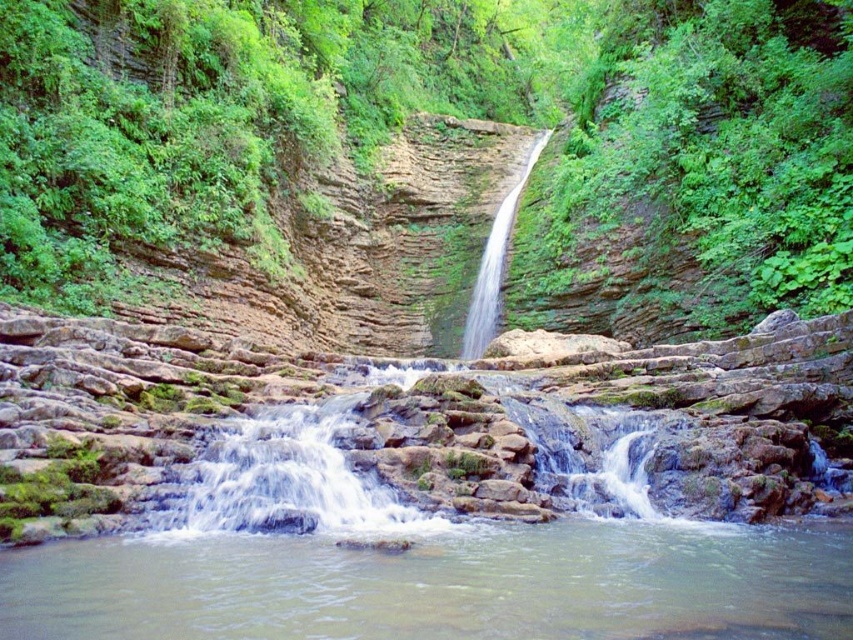
Is clear water stream at center wider than white frothy water at center?

Indeed, clear water stream at center has a greater width compared to white frothy water at center.

Locate an element on the screen. Image resolution: width=853 pixels, height=640 pixels. clear water stream at center is located at coordinates (440, 584).

This screenshot has width=853, height=640. What are the coordinates of `clear water stream at center` in the screenshot? It's located at (440, 584).

The width and height of the screenshot is (853, 640). I want to click on clear water stream at center, so click(x=440, y=584).

Is green leafy vegetation at center smaller than clear water stream at center?

Incorrect, green leafy vegetation at center is not smaller in size than clear water stream at center.

From the picture: Can you confirm if green leafy vegetation at center is thinner than clear water stream at center?

Incorrect, green leafy vegetation at center's width is not less than clear water stream at center's.

Describe the element at coordinates (437, 112) in the screenshot. Image resolution: width=853 pixels, height=640 pixels. I see `green leafy vegetation at center` at that location.

In order to click on green leafy vegetation at center in this screenshot , I will do `click(437, 112)`.

Is green leafy vegetation at center shorter than white frothy water at center?

No, green leafy vegetation at center is not shorter than white frothy water at center.

Between green leafy vegetation at center and white frothy water at center, which one appears on the left side from the viewer's perspective?

From the viewer's perspective, white frothy water at center appears more on the left side.

Who is more forward, (x=508, y=26) or (x=306, y=513)?

Point (x=306, y=513) is more forward.

I want to click on green leafy vegetation at center, so click(437, 112).